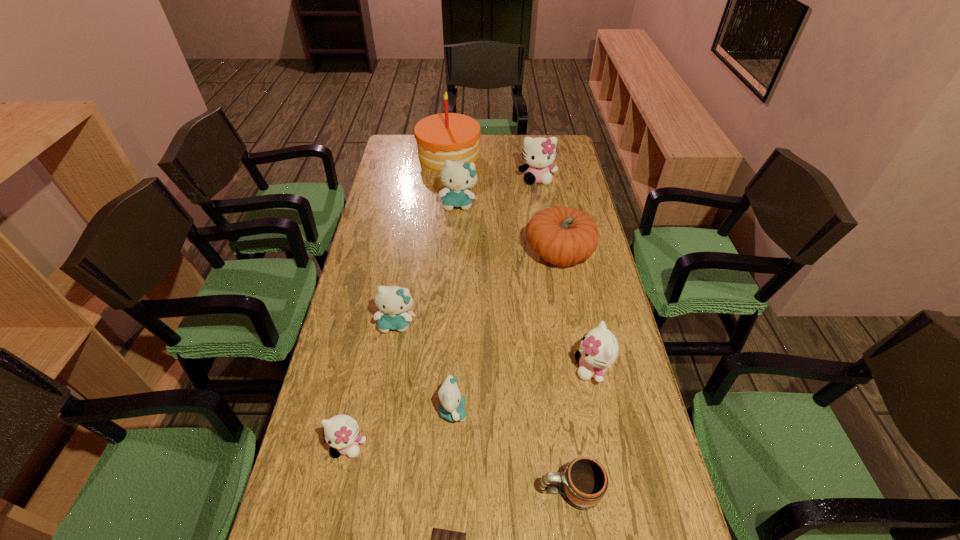
Point out which kitten is positioned as the second nearest to the fourth nearest object. Please provide its 2D coordinates. Your answer should be formatted as a tuple, i.e. [(x, y)], where the tuple contains the x and y coordinates of a point satisfying the conditions above.

[(394, 302)]

Point out which blue kitten is positioned as the nearest to the nearest object. Please provide its 2D coordinates. Your answer should be formatted as a tuple, i.e. [(x, y)], where the tuple contains the x and y coordinates of a point satisfying the conditions above.

[(451, 408)]

Locate an element on the screen. The height and width of the screenshot is (540, 960). blue kitten that stands as the second closest to the biggest white kitten is located at coordinates (394, 302).

Identify which white kitten is located as the nearest to the seventh farthest object. Please provide its 2D coordinates. Your answer should be formatted as a tuple, i.e. [(x, y)], where the tuple contains the x and y coordinates of a point satisfying the conditions above.

[(341, 432)]

Identify which white kitten is located as the third nearest to the orange pumpkin. Please provide its 2D coordinates. Your answer should be formatted as a tuple, i.e. [(x, y)], where the tuple contains the x and y coordinates of a point satisfying the conditions above.

[(341, 432)]

I want to click on free location that satisfies the following two spatial constraints: 1. on the face of the seventh nearest object; 2. on the right side of the biggest blue kitten, so click(456, 253).